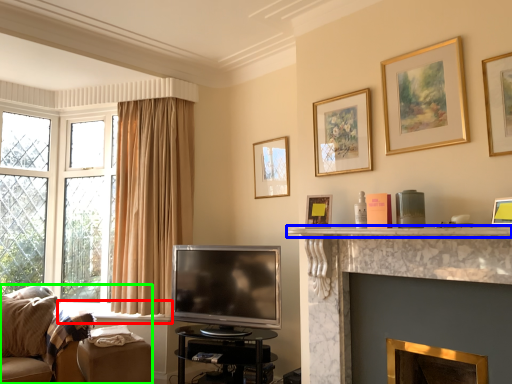
Question: Estimate the real-world distances between objects in this image. Which object is closer to window sill (highlighted by a red box), mantle (highlighted by a blue box) or studio couch (highlighted by a green box)?

Choices:
 (A) mantle
 (B) studio couch

Answer: (B)